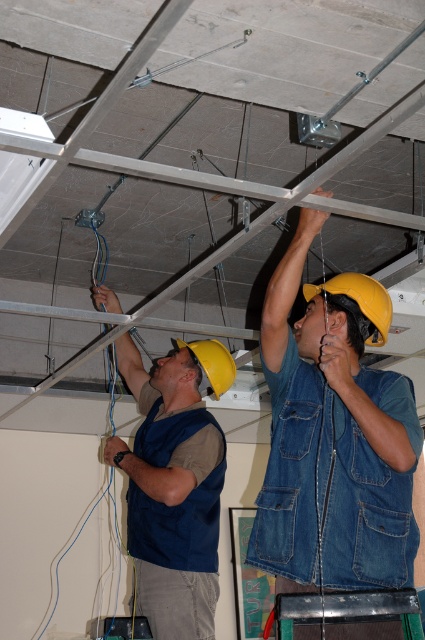
Between blue denim vest at center and yellow matte helmet at center, which one has less height?

yellow matte helmet at center is shorter.

Which is more to the right, blue denim vest at center or yellow matte helmet at center?

yellow matte helmet at center

Is point (150, 417) positioned in front of point (227, 385)?

That is True.

Locate an element on the screen. The height and width of the screenshot is (640, 425). blue denim vest at center is located at coordinates (172, 493).

Does point (249, 554) come closer to viewer compared to point (189, 429)?

Yes.

Is denim vest at upper center positioned before blue denim vest at center?

Yes, it is.

Which is behind, point (387, 413) or point (163, 484)?

Positioned behind is point (163, 484).

Locate an element on the screen. The image size is (425, 640). denim vest at upper center is located at coordinates (334, 435).

Between denim vest at upper center and yellow hard hat at upper center, which one is positioned lower?

denim vest at upper center

Does point (325, 576) lie behind point (368, 337)?

No, (325, 576) is in front of (368, 337).

At what (x,y) coordinates should I click in order to perform the action: click on denim vest at upper center. Please return your answer as a coordinate pair (x, y). This screenshot has height=640, width=425. Looking at the image, I should click on (334, 435).